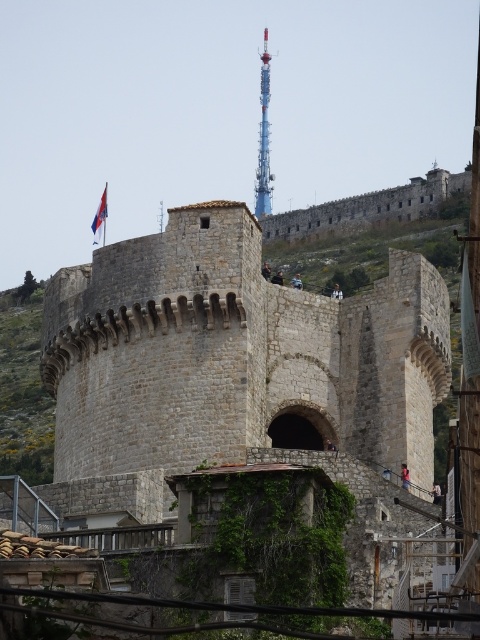
Question: Which point is farther to the camera?

Choices:
 (A) stone castle at center
 (B) blue metallic tower at center
 (C) red fabric flag at upper left

Answer: (B)

Question: Which object appears closest to the camera in this image?

Choices:
 (A) stone castle at center
 (B) blue metallic tower at center
 (C) red fabric flag at upper left

Answer: (A)

Question: Is stone castle at center smaller than red fabric flag at upper left?

Choices:
 (A) yes
 (B) no

Answer: (B)

Question: Can you confirm if stone castle at center is smaller than red fabric flag at upper left?

Choices:
 (A) yes
 (B) no

Answer: (B)

Question: Which of these objects is positioned closest to the blue metallic tower at center?

Choices:
 (A) red fabric flag at upper left
 (B) stone castle at center

Answer: (A)

Question: Does blue metallic tower at center lie in front of red fabric flag at upper left?

Choices:
 (A) no
 (B) yes

Answer: (A)